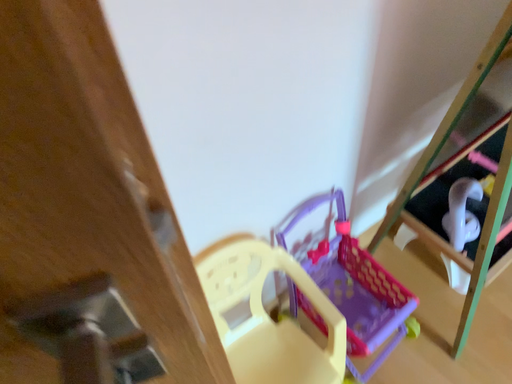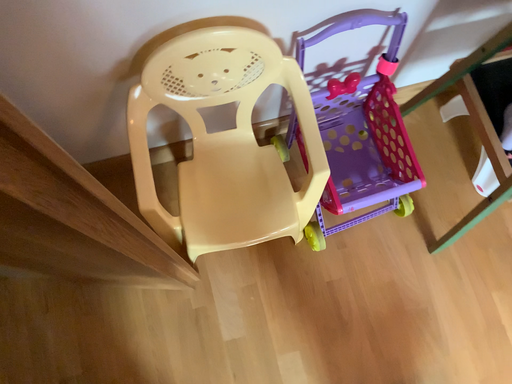
Question: Which way did the camera rotate in the video?

Choices:
 (A) rotated upward
 (B) rotated downward

Answer: (B)